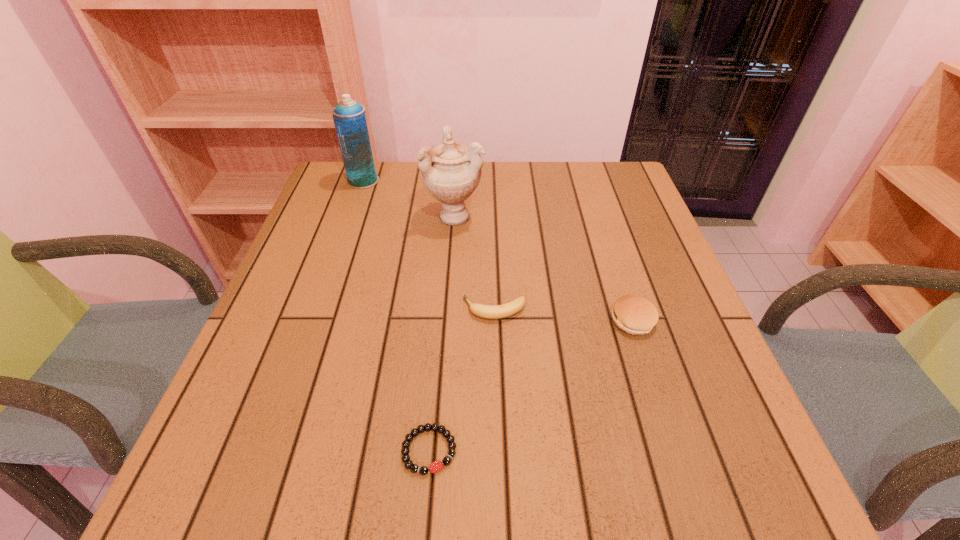
The image size is (960, 540). Find the location of `object present at the far left corner`. object present at the far left corner is located at coordinates (x=349, y=118).

Find the location of a particular element. This screenshot has width=960, height=540. vacant space at the far edge is located at coordinates (399, 206).

Find the location of a particular element. This screenshot has height=540, width=960. vacant point at the near edge is located at coordinates (431, 456).

You are a GUI agent. You are given a task and a screenshot of the screen. Output one action in this format:
    pyautogui.click(x=<x>, y=<y>)
    Task: Click on the free spot at the right edge of the desktop
    This screenshot has width=960, height=540.
    Given the screenshot: What is the action you would take?
    pyautogui.click(x=629, y=280)

Where is `blank space at the near left corner`? The width and height of the screenshot is (960, 540). blank space at the near left corner is located at coordinates (197, 462).

The image size is (960, 540). In order to click on free spot at the near right corner of the desktop in this screenshot , I will do `click(659, 458)`.

Image resolution: width=960 pixels, height=540 pixels. I want to click on vacant area between the farthest object and the second farthest object, so click(x=409, y=198).

I want to click on free space between the farthest object and the patty, so click(x=498, y=251).

The width and height of the screenshot is (960, 540). Find the location of `free space between the urn and the bracelet`. free space between the urn and the bracelet is located at coordinates (443, 333).

This screenshot has width=960, height=540. Identify the location of vacant area that lies between the second farthest object and the shortest object. (443, 333).